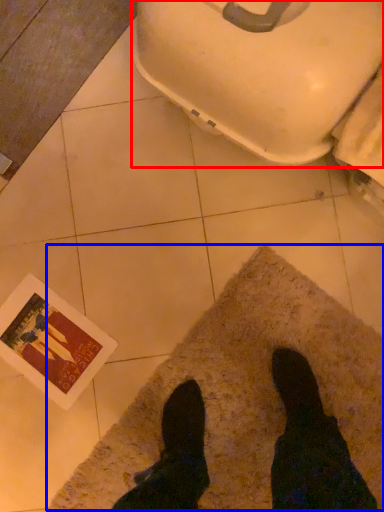
Question: Which object is closer to the camera taking this photo, toilet bowl (highlighted by a red box) or mat (highlighted by a blue box)?

Choices:
 (A) toilet bowl
 (B) mat

Answer: (A)